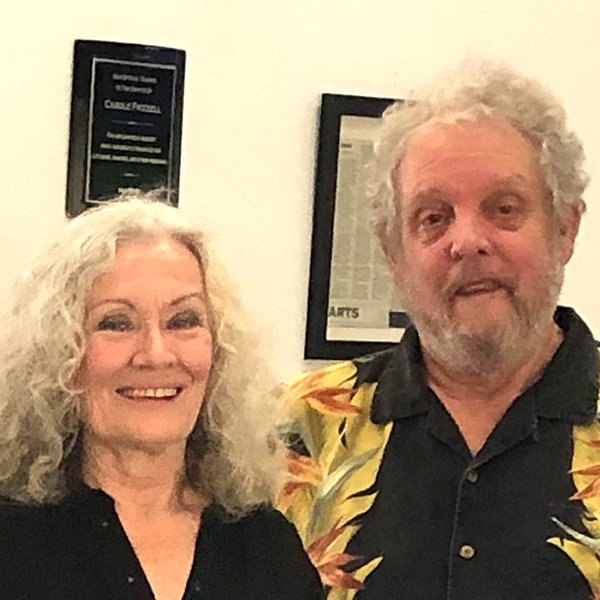
You are a GUI agent. You are given a task and a screenshot of the screen. Output one action in this format:
    pyautogui.click(x=<x>, y=<y>)
    Task: Click on the award
    The height and width of the screenshot is (600, 600).
    Given the screenshot: What is the action you would take?
    pyautogui.click(x=135, y=119)